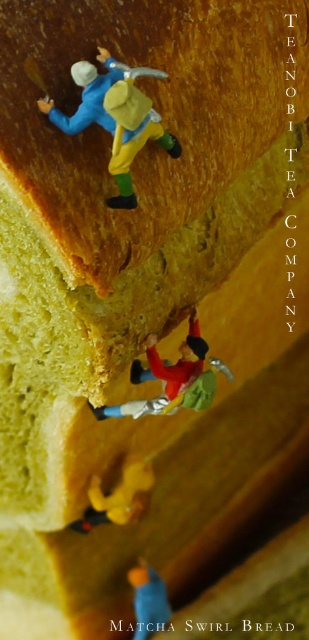
Who is shorter, matte plastic toy at upper left or yellow matte toy at lower center?

Standing shorter between the two is yellow matte toy at lower center.

Is matte plastic toy at upper left closer to camera compared to yellow matte toy at lower center?

Yes, it is.

What do you see at coordinates (113, 120) in the screenshot? The width and height of the screenshot is (309, 640). I see `matte plastic toy at upper left` at bounding box center [113, 120].

Find the location of a particular element. This screenshot has width=309, height=640. matte plastic toy at upper left is located at coordinates (113, 120).

Is yellow matte toy at lower center positioned at the back of blue matte toy at lower center?

No, yellow matte toy at lower center is closer to the viewer.

Looking at this image, does yellow matte toy at lower center have a greater height compared to blue matte toy at lower center?

No, yellow matte toy at lower center is not taller than blue matte toy at lower center.

Which is behind, point (88, 520) or point (139, 563)?

Positioned behind is point (139, 563).

Locate an element on the screen. This screenshot has width=309, height=640. yellow matte toy at lower center is located at coordinates (118, 497).

Is point (191, 314) positioned before point (98, 500)?

Yes, point (191, 314) is closer to viewer.

Which is in front, point (187, 385) or point (131, 488)?

Positioned in front is point (187, 385).

At what (x,y) coordinates should I click in order to perform the action: click on red fabric climbing gear at center. Please return your answer as a coordinate pair (x, y). Looking at the image, I should click on (173, 378).